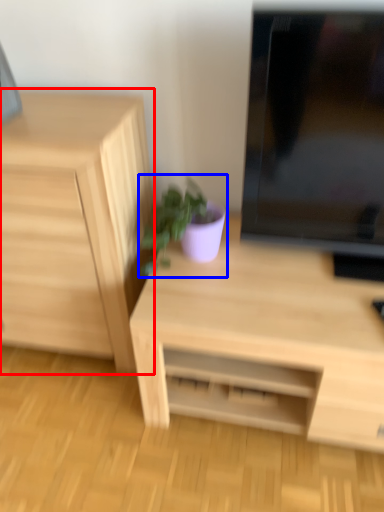
Question: Which point is closer to the camera, chest of drawers (highlighted by a red box) or houseplant (highlighted by a blue box)?

Choices:
 (A) chest of drawers
 (B) houseplant

Answer: (A)